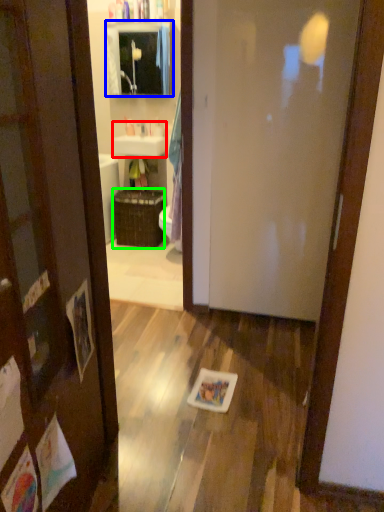
Question: Considering the real-world distances, which object is closest to sink (highlighted by a red box)? cabinetry (highlighted by a blue box) or basket (highlighted by a green box).

Choices:
 (A) cabinetry
 (B) basket

Answer: (B)